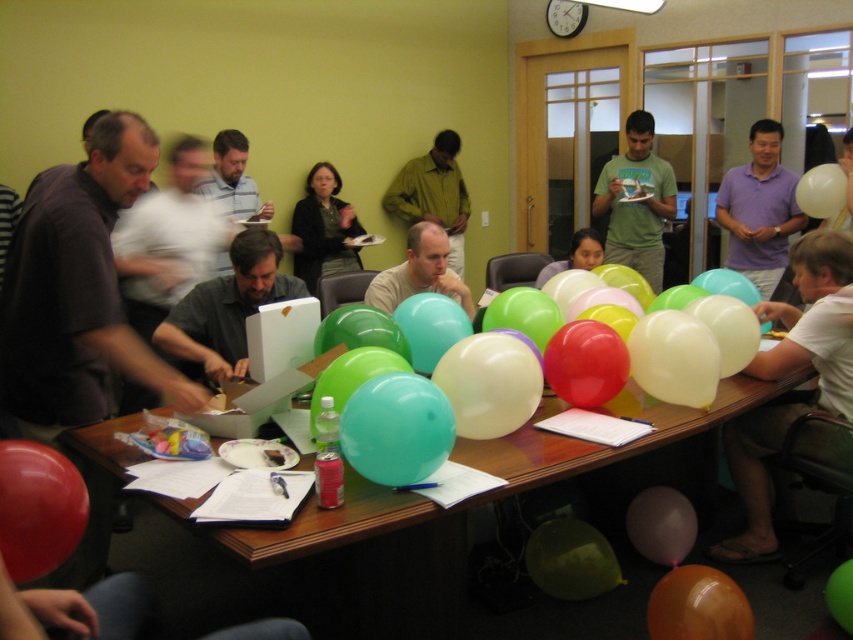
Question: Which point is closer to the camera?

Choices:
 (A) (625, 520)
 (B) (637, 205)

Answer: (A)

Question: Is translucent purple balloon at lower center below green rubber balloon at center?

Choices:
 (A) no
 (B) yes

Answer: (A)

Question: Is matte brown shirt at left above matte black sweater at center?

Choices:
 (A) yes
 (B) no

Answer: (B)

Question: Among these objects, which one is nearest to the camera?

Choices:
 (A) white cotton shirt at right
 (B) white matte balloon at upper right

Answer: (A)

Question: Can you confirm if teal glossy balloon at center is thinner than rubberized red balloon at lower left?

Choices:
 (A) yes
 (B) no

Answer: (B)

Question: Which object is positioned closest to the orange glossy balloon at lower right?

Choices:
 (A) green matte shirt at center
 (B) white cotton shirt at right

Answer: (B)